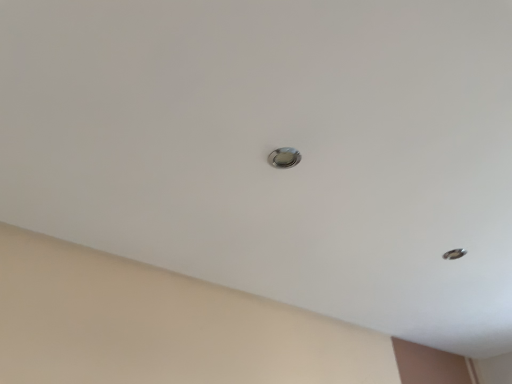
Identify the location of metallic hole at upper right. The height and width of the screenshot is (384, 512). (454, 254).

Measure the distance between point (454, 253) and camera.

The distance of point (454, 253) from camera is 1.52 meters.

Describe the element at coordinates (454, 254) in the screenshot. This screenshot has width=512, height=384. I see `metallic hole at upper right` at that location.

Describe the element at coordinates (284, 158) in the screenshot. Image resolution: width=512 pixels, height=384 pixels. I see `satin silver door handle at center` at that location.

Where is `satin silver door handle at center`? The height and width of the screenshot is (384, 512). satin silver door handle at center is located at coordinates (284, 158).

Where is `metallic hole at upper right`? The image size is (512, 384). metallic hole at upper right is located at coordinates (454, 254).

Which object is positioned more to the left, satin silver door handle at center or metallic hole at upper right?

satin silver door handle at center.

Is satin silver door handle at center closer to camera compared to metallic hole at upper right?

Yes, satin silver door handle at center is closer to the camera.

Which is behind, point (279, 161) or point (444, 254)?

The point (444, 254) is farther from the camera.

From the image's perspective, between satin silver door handle at center and metallic hole at upper right, who is located below?

metallic hole at upper right.

In the scene shown: From a real-world perspective, is satin silver door handle at center located higher than metallic hole at upper right?

Actually, satin silver door handle at center is physically below metallic hole at upper right in the real world.

Is satin silver door handle at center thinner than metallic hole at upper right?

Yes.

In terms of height, does satin silver door handle at center look taller or shorter compared to metallic hole at upper right?

In the image, satin silver door handle at center appears to be shorter than metallic hole at upper right.

Who is bigger, satin silver door handle at center or metallic hole at upper right?

Bigger between the two is metallic hole at upper right.

Is metallic hole at upper right located within satin silver door handle at center?

No.

Would you say satin silver door handle at center is a long distance from metallic hole at upper right?

Result: No, satin silver door handle at center is not far from metallic hole at upper right.

Is satin silver door handle at center oriented towards metallic hole at upper right?

Yes, satin silver door handle at center is aimed at metallic hole at upper right.

How many degrees apart are the facing directions of satin silver door handle at center and metallic hole at upper right?

The angular difference between satin silver door handle at center and metallic hole at upper right is 179 degrees.

The width and height of the screenshot is (512, 384). I want to click on door handle above the metallic hole at upper right (from the image's perspective), so click(x=284, y=158).

Considering the relative positions of metallic hole at upper right and satin silver door handle at center in the image provided, is metallic hole at upper right to the right of satin silver door handle at center from the viewer's perspective?

Yes.

Considering their positions, is metallic hole at upper right located in front of or behind satin silver door handle at center?

metallic hole at upper right is positioned farther from the viewer than satin silver door handle at center.

Which point is more distant from viewer, (450,255) or (289,160)?

Positioned behind is point (450,255).

From the image's perspective, which is above, metallic hole at upper right or satin silver door handle at center?

satin silver door handle at center.

From a real-world perspective, which is physically below, metallic hole at upper right or satin silver door handle at center?

From a 3D spatial view, satin silver door handle at center is below.

Between metallic hole at upper right and satin silver door handle at center, which one has smaller width?

With smaller width is satin silver door handle at center.

Is metallic hole at upper right taller than satin silver door handle at center?

Yes, metallic hole at upper right is taller than satin silver door handle at center.

Is metallic hole at upper right bigger than satin silver door handle at center?

Yes, metallic hole at upper right is bigger than satin silver door handle at center.

Would you say metallic hole at upper right contains satin silver door handle at center?

That's incorrect, satin silver door handle at center is not inside metallic hole at upper right.

Are metallic hole at upper right and satin silver door handle at center far apart?

metallic hole at upper right is near satin silver door handle at center, not far away.

Could you tell me if metallic hole at upper right is turned towards satin silver door handle at center?

Yes, metallic hole at upper right is turned towards satin silver door handle at center.

How different are the orientations of metallic hole at upper right and satin silver door handle at center in degrees?

179 degrees.

Measure the distance between metallic hole at upper right and satin silver door handle at center.

32.67 inches.

Locate an element on the screen. The width and height of the screenshot is (512, 384). door handle in front of the metallic hole at upper right is located at coordinates (284, 158).

Where is `hole above the satin silver door handle at center (from a real-world perspective)`? hole above the satin silver door handle at center (from a real-world perspective) is located at coordinates (454, 254).

Locate an element on the screen. The width and height of the screenshot is (512, 384). hole that appears behind the satin silver door handle at center is located at coordinates (454, 254).